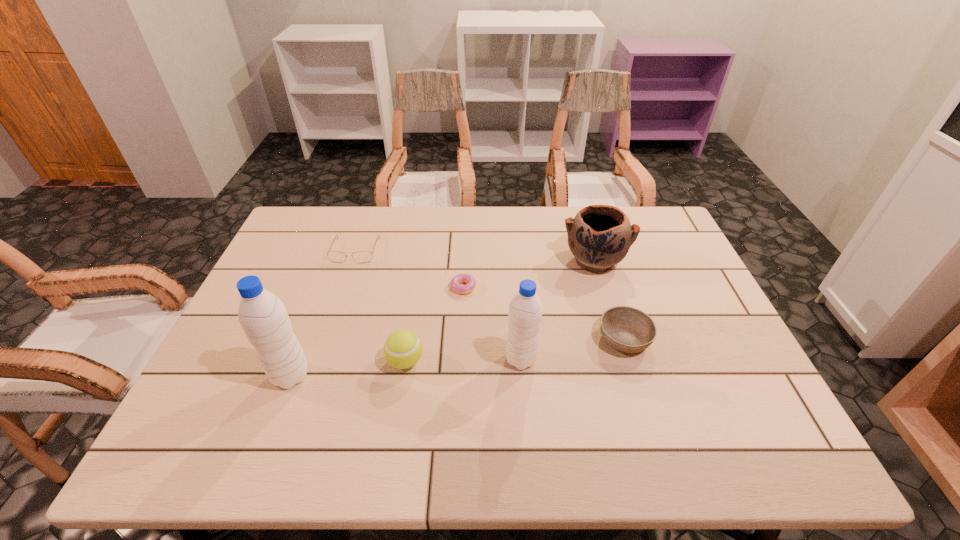
Where is `the tallest object`? the tallest object is located at coordinates (262, 315).

What are the coordinates of `the left water bottle` in the screenshot? It's located at (262, 315).

Identify the location of the shorter water bottle. (525, 309).

Where is `the second tallest object`? The image size is (960, 540). the second tallest object is located at coordinates (525, 309).

Locate an element on the screen. the shortest object is located at coordinates (455, 282).

What are the coordinates of `doughnut` in the screenshot? It's located at (455, 282).

Where is `the sixth tallest object`? The width and height of the screenshot is (960, 540). the sixth tallest object is located at coordinates click(x=361, y=256).

Locate an element on the screen. the fifth shortest object is located at coordinates (600, 236).

Where is `bowl`? The width and height of the screenshot is (960, 540). bowl is located at coordinates (627, 329).

Locate an element on the screen. This screenshot has height=540, width=960. the fourth shortest object is located at coordinates (402, 349).